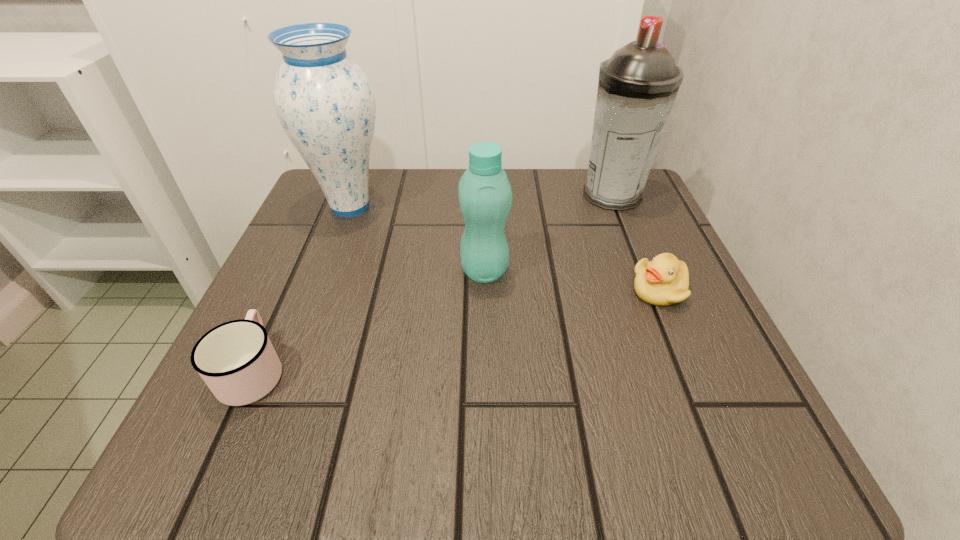
Where is `free region located on the beak of the duckling`? free region located on the beak of the duckling is located at coordinates (562, 290).

You are a GUI agent. You are given a task and a screenshot of the screen. Output one action in this format:
    pyautogui.click(x=<x>, y=<y>)
    Task: Click on the blank space located on the beak of the duckling
    
    Given the screenshot: What is the action you would take?
    pyautogui.click(x=562, y=290)

Identify the location of free space located 0.130m on the side of the nearest object with the handle. This screenshot has width=960, height=540. (294, 280).

Where is `vacant position located 0.170m on the side of the nearest object with the handle`? vacant position located 0.170m on the side of the nearest object with the handle is located at coordinates (300, 265).

Where is `blank space located on the side of the nearest object with the handle`? The image size is (960, 540). blank space located on the side of the nearest object with the handle is located at coordinates (328, 203).

Find the location of a particular element. aerosol can present at the far edge is located at coordinates (638, 84).

This screenshot has height=540, width=960. Find the location of `vase situated at the far edge`. vase situated at the far edge is located at coordinates (325, 103).

This screenshot has height=540, width=960. What are the coordinates of `object located in the near edge section of the desktop` in the screenshot? It's located at (237, 361).

The image size is (960, 540). Find the location of `vase present at the left edge`. vase present at the left edge is located at coordinates (325, 103).

I want to click on mug located at the left edge, so click(x=237, y=361).